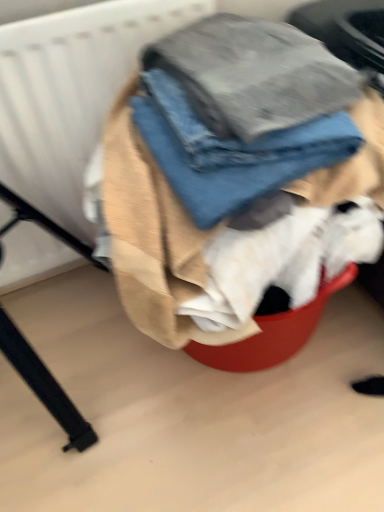
The width and height of the screenshot is (384, 512). Identify the location of white textured radiator at upper left. (71, 93).

Describe the element at coordinates (230, 151) in the screenshot. I see `denim jeans at center` at that location.

Locate an element on the screen. Image resolution: width=384 pixels, height=512 pixels. denim fabric at center is located at coordinates (225, 174).

From the image's perspective, is denim jeans at center located above or below white textured radiator at upper left?

denim jeans at center is below white textured radiator at upper left.

From a real-world perspective, relative to white textured radiator at upper left, is denim jeans at center vertically above or below?

denim jeans at center is situated higher than white textured radiator at upper left in the real world.

Is denim jeans at center bigger or smaller than white textured radiator at upper left?

Considering their sizes, denim jeans at center takes up less space than white textured radiator at upper left.

Can you confirm if denim jeans at center is shorter than white textured radiator at upper left?

Indeed, denim jeans at center has a lesser height compared to white textured radiator at upper left.

At what (x,y) coordinates should I click in order to perform the action: click on laundry in front of the white textured radiator at upper left. Please return your answer as a coordinate pair (x, y). This screenshot has height=512, width=384. Looking at the image, I should click on (225, 174).

Considering the relative positions of denim fabric at center and white textured radiator at upper left in the image provided, is denim fabric at center in front of white textured radiator at upper left?

Yes, denim fabric at center is closer to the camera.

In the scene shown: Does denim fabric at center appear on the left side of white textured radiator at upper left?

Incorrect, denim fabric at center is not on the left side of white textured radiator at upper left.

How different are the orientations of denim fabric at center and denim jeans at center in degrees?

The angular difference between denim fabric at center and denim jeans at center is 0.000195 degrees.

Is denim fabric at center bigger or smaller than denim jeans at center?

Clearly, denim fabric at center is larger in size than denim jeans at center.

In terms of height, does denim fabric at center look taller or shorter compared to denim jeans at center?

denim fabric at center is taller than denim jeans at center.

Considering the relative sizes of denim fabric at center and denim jeans at center in the image provided, is denim fabric at center wider than denim jeans at center?

Yes, denim fabric at center is wider than denim jeans at center.

Looking at this image, is denim jeans at center taller than denim fabric at center?

No, denim jeans at center is not taller than denim fabric at center.

Is denim jeans at center next to denim fabric at center and touching it?

Yes, denim jeans at center is next to denim fabric at center.

Does point (154, 156) come closer to viewer compared to point (259, 252)?

That is True.

From a real-world perspective, is denim jeans at center under denim fabric at center?

No, from a real-world perspective, denim jeans at center is not below denim fabric at center.

Would you consider white textured radiator at upper left to be distant from denim jeans at center?

They are positioned close to each other.

Who is shorter, white textured radiator at upper left or denim jeans at center?

denim jeans at center.

Between white textured radiator at upper left and denim jeans at center, which one has larger width?

denim jeans at center.

Considering the relative sizes of white textured radiator at upper left and denim fabric at center in the image provided, is white textured radiator at upper left thinner than denim fabric at center?

Indeed, white textured radiator at upper left has a lesser width compared to denim fabric at center.

Is the depth of white textured radiator at upper left greater than that of denim fabric at center?

Yes, white textured radiator at upper left is further from the viewer.

Are white textured radiator at upper left and denim fabric at center located far from each other?

They are positioned close to each other.

Where is `radiator behind the denim jeans at center`? Image resolution: width=384 pixels, height=512 pixels. radiator behind the denim jeans at center is located at coordinates (71, 93).

Find the location of a particular element. laundry to the right of white textured radiator at upper left is located at coordinates (225, 174).

Which object lies nearer to the anchor point denim fabric at center, white textured radiator at upper left or denim jeans at center?

Among the two, denim jeans at center is located nearer to denim fabric at center.

In the scene shown: Estimate the real-world distances between objects in this image. Which object is further from denim jeans at center, white textured radiator at upper left or denim fabric at center?

white textured radiator at upper left lies further to denim jeans at center than the other object.

Based on their spatial positions, is denim fabric at center or white textured radiator at upper left further from denim jeans at center?

white textured radiator at upper left.

Considering their positions, is denim fabric at center positioned further to white textured radiator at upper left than denim jeans at center?

Among the two, denim jeans at center is located further to white textured radiator at upper left.

Based on their spatial positions, is denim jeans at center or white textured radiator at upper left closer to denim fabric at center?

Based on the image, denim jeans at center appears to be nearer to denim fabric at center.

From the image, which object appears to be nearer to white textured radiator at upper left, denim jeans at center or denim fabric at center?

The object closer to white textured radiator at upper left is denim fabric at center.

What are the coordinates of `trousers situated between white textured radiator at upper left and denim fabric at center from left to right` in the screenshot? It's located at (230, 151).